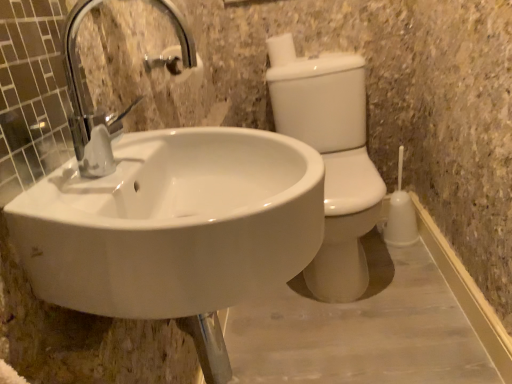
This screenshot has width=512, height=384. Describe the element at coordinates (173, 223) in the screenshot. I see `white glossy sink at center` at that location.

What do you see at coordinates (333, 162) in the screenshot? This screenshot has height=384, width=512. I see `white glossy toilet bowl at right` at bounding box center [333, 162].

Locate an element on the screen. white matte toilet paper at upper center is located at coordinates (281, 49).

From a real-world perspective, which object rests below the other?

white glossy sink at center, from a real-world perspective.

Can you confirm if white glossy sink at center is bigger than white matte toilet paper at upper center?

Yes.

Is white glossy sink at center next to white matte toilet paper at upper center and touching it?

No, white glossy sink at center is not beside white matte toilet paper at upper center.

How many degrees apart are the facing directions of white glossy sink at center and white matte toilet paper at upper center?

white glossy sink at center and white matte toilet paper at upper center are facing 87.8 degrees away from each other.

Is white matte toilet paper at upper center oriented towards white glossy sink at center?

Yes, white matte toilet paper at upper center is turned towards white glossy sink at center.

Between white matte toilet paper at upper center and white glossy sink at center, which one is positioned behind?

white matte toilet paper at upper center is further from the camera.

Which object is positioned more to the right, white matte toilet paper at upper center or white glossy sink at center?

Positioned to the right is white matte toilet paper at upper center.

Is white matte toilet paper at upper center positioned with its back to white glossy toilet bowl at right?

white matte toilet paper at upper center does not have its back to white glossy toilet bowl at right.

Is white matte toilet paper at upper center located outside white glossy toilet bowl at right?

Indeed, white matte toilet paper at upper center is completely outside white glossy toilet bowl at right.

Between white matte toilet paper at upper center and white glossy toilet bowl at right, which one has less height?

white matte toilet paper at upper center.

Consider the image. Which object is positioned more to the left, white glossy toilet bowl at right or white matte toilet paper at upper center?

Positioned to the left is white matte toilet paper at upper center.

Find the location of a particular element. The image size is (512, 384). toilet paper located behind the white glossy toilet bowl at right is located at coordinates [281, 49].

Is white glossy toilet bowl at right further to camera compared to white matte toilet paper at upper center?

No, white glossy toilet bowl at right is closer to the camera.

Is white glossy toilet bowl at right shorter than white glossy sink at center?

Incorrect, the height of white glossy toilet bowl at right does not fall short of that of white glossy sink at center.

Is white glossy toilet bowl at right turned away from white glossy sink at center?

white glossy toilet bowl at right is not turned away from white glossy sink at center.

Considering the relative positions of white glossy toilet bowl at right and white glossy sink at center in the image provided, is white glossy toilet bowl at right to the left of white glossy sink at center from the viewer's perspective?

Incorrect, white glossy toilet bowl at right is not on the left side of white glossy sink at center.

Find the location of a particular element. toilet bowl located behind the white glossy sink at center is located at coordinates (333, 162).

What are the coordinates of `sink positioned vertically above the white glossy toilet bowl at right (from a real-world perspective)` in the screenshot? It's located at (173, 223).

Between white glossy sink at center and white glossy toilet bowl at right, which one has smaller width?

Thinner between the two is white glossy sink at center.

Is white glossy sink at center oriented away from white glossy toilet bowl at right?

No, white glossy sink at center's orientation is not away from white glossy toilet bowl at right.

Considering the points (162, 213) and (347, 214), which point is behind, point (162, 213) or point (347, 214)?

The point (347, 214) is behind.

Locate an element on the screen. toilet paper behind the white glossy sink at center is located at coordinates pos(281,49).

Locate an element on the screen. The height and width of the screenshot is (384, 512). sink below the white matte toilet paper at upper center (from the image's perspective) is located at coordinates (173, 223).

Which object lies nearer to the anchor point white glossy toilet bowl at right, white matte toilet paper at upper center or white glossy sink at center?

Among the two, white matte toilet paper at upper center is located nearer to white glossy toilet bowl at right.

Which object lies further to the anchor point white glossy toilet bowl at right, white glossy sink at center or white matte toilet paper at upper center?

white glossy sink at center.

Based on their spatial positions, is white glossy toilet bowl at right or white glossy sink at center further from white matte toilet paper at upper center?

white glossy sink at center is positioned further to the anchor white matte toilet paper at upper center.

Based on their spatial positions, is white matte toilet paper at upper center or white glossy toilet bowl at right further from white glossy sink at center?

Among the two, white matte toilet paper at upper center is located further to white glossy sink at center.

Based on the photo, when comparing their distances from white glossy sink at center, does white glossy toilet bowl at right or white matte toilet paper at upper center seem further?

The object further to white glossy sink at center is white matte toilet paper at upper center.

Based on their spatial positions, is white glossy sink at center or white glossy toilet bowl at right closer to white matte toilet paper at upper center?

white glossy toilet bowl at right is closer to white matte toilet paper at upper center.

Where is `toilet bowl between white glossy sink at center and white matte toilet paper at upper center from front to back`? This screenshot has width=512, height=384. toilet bowl between white glossy sink at center and white matte toilet paper at upper center from front to back is located at coordinates (333, 162).